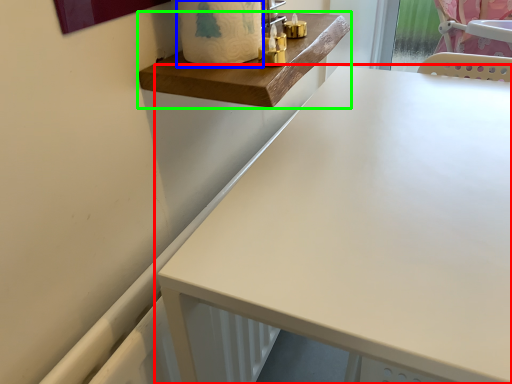
Question: Which is nearer to the table (highlighted by a red box)? toilet paper (highlighted by a blue box) or changing table (highlighted by a green box).

Choices:
 (A) toilet paper
 (B) changing table

Answer: (B)